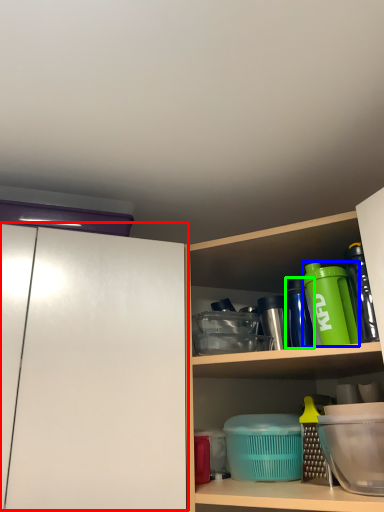
Question: Estimate the real-world distances between objects in this image. Which object is farther from glass door (highlighted by a red box), bottle (highlighted by a blue box) or bottle (highlighted by a green box)?

Choices:
 (A) bottle
 (B) bottle

Answer: (B)